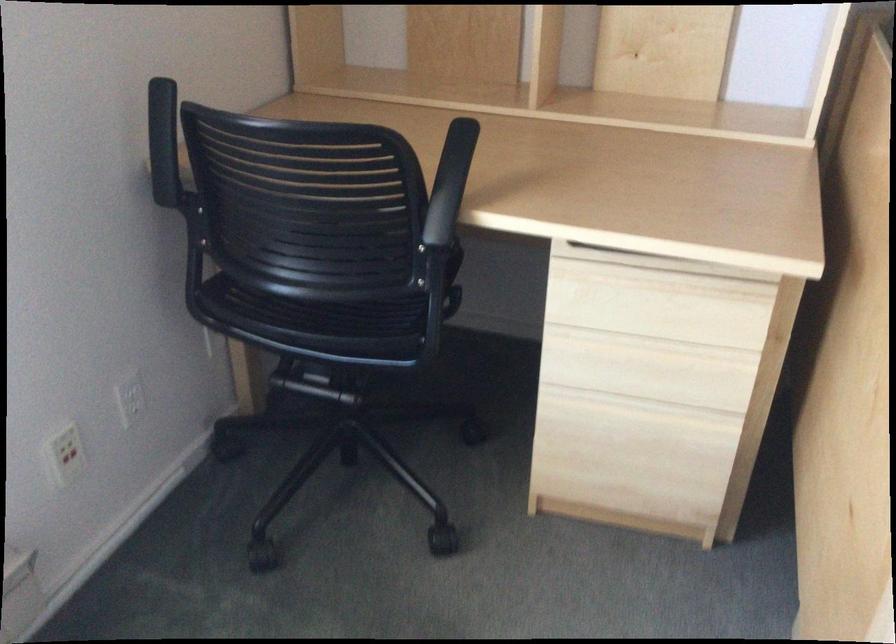
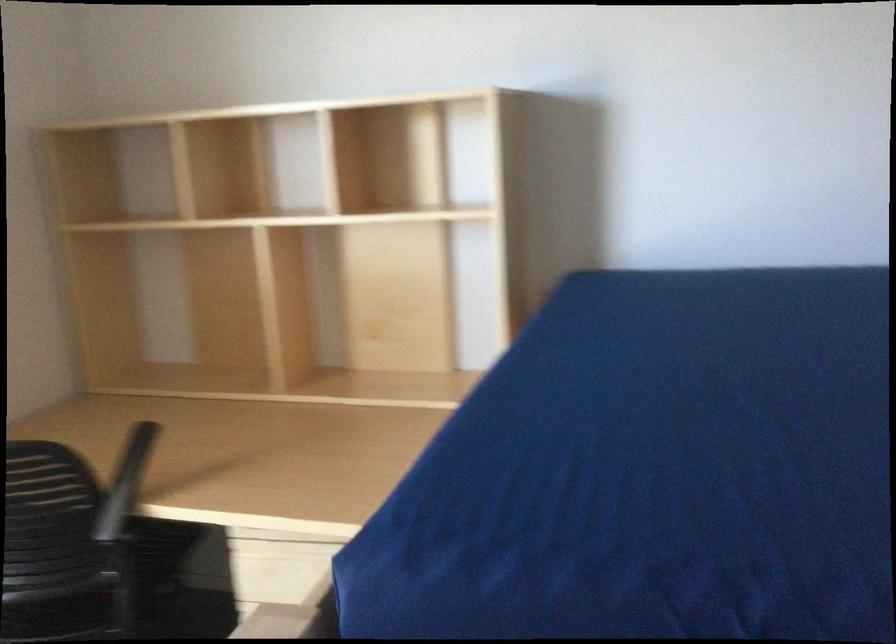
Question: What movement of the cameraman would produce the second image?

Choices:
 (A) Left
 (B) Right
 (C) Forward
 (D) Backward

Answer: (B)